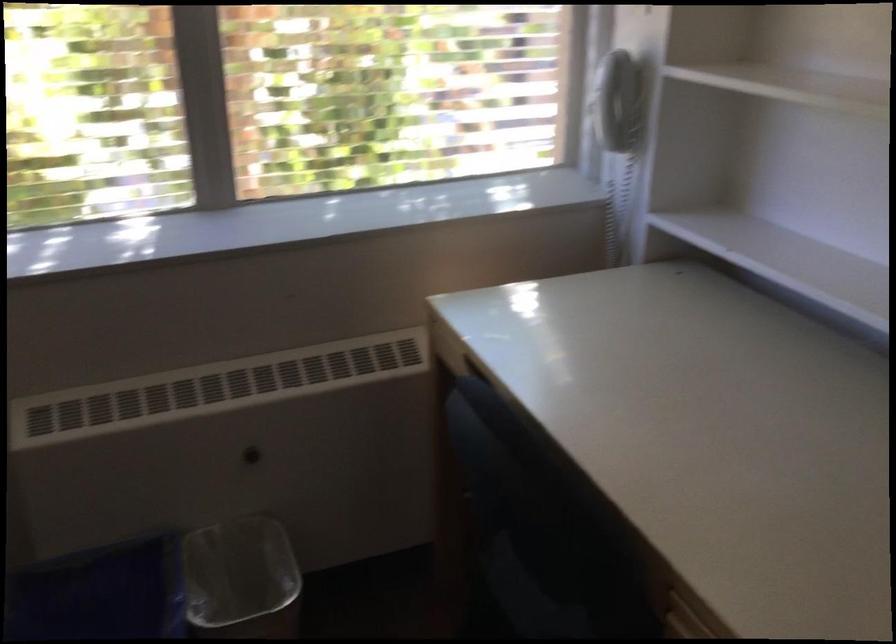
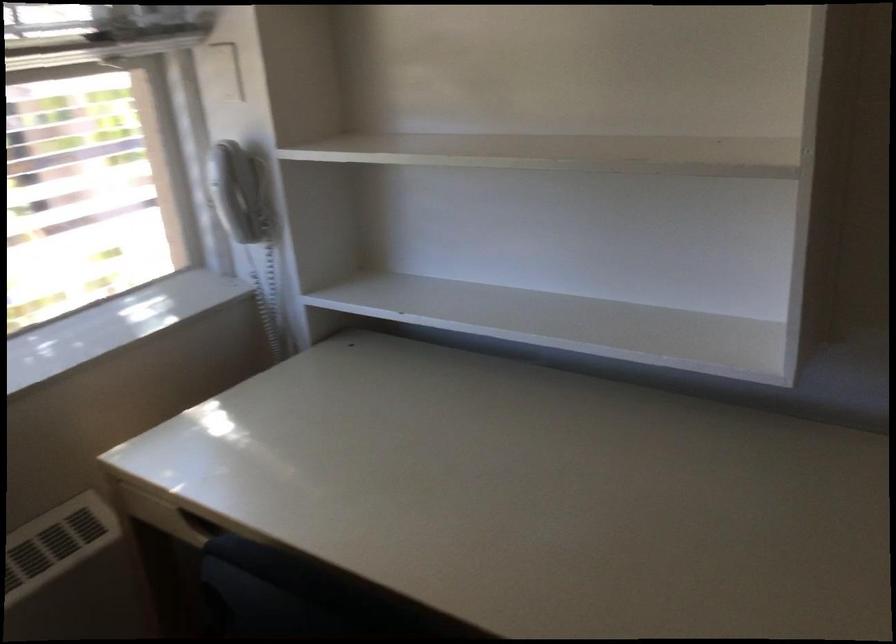
The point at (x=607, y=91) is marked in the first image. Where is the corresponding point in the second image?

(230, 190)